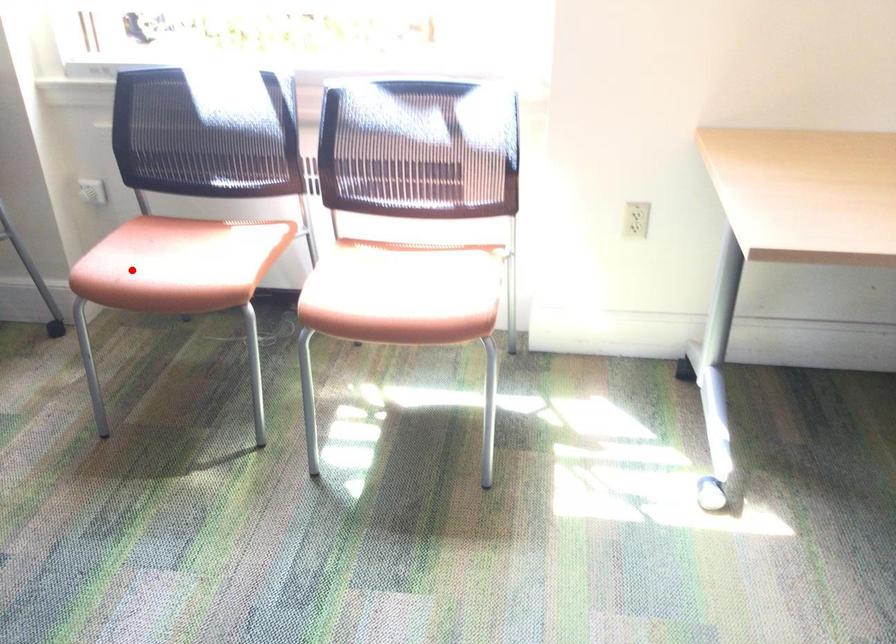
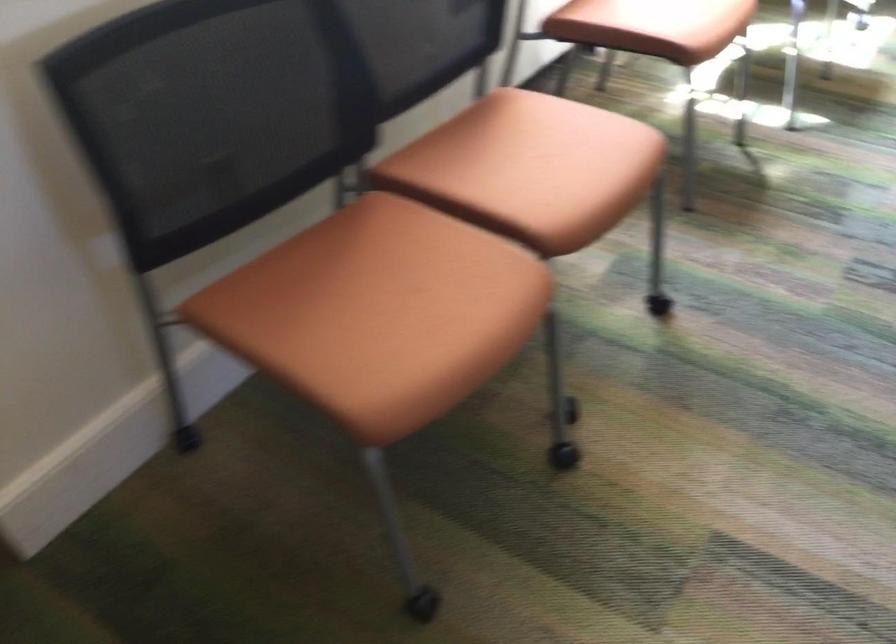
Where in the second image is the point corresponding to the highlighted location from the first image?

(684, 23)